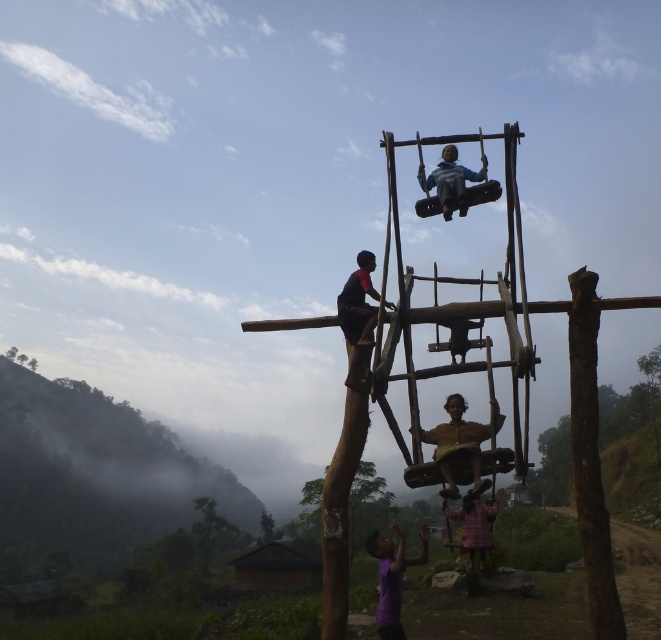
Between brown wooden swing at center and plaid fabric child at lower center, which one appears on the right side from the viewer's perspective?

Positioned to the right is plaid fabric child at lower center.

Can you confirm if brown wooden swing at center is bigger than plaid fabric child at lower center?

Incorrect, brown wooden swing at center is not larger than plaid fabric child at lower center.

You are a GUI agent. You are given a task and a screenshot of the screen. Output one action in this format:
    pyautogui.click(x=<x>, y=<y>)
    Task: Click on the brown wooden swing at center
    This screenshot has height=640, width=661.
    Given the screenshot: What is the action you would take?
    pyautogui.click(x=457, y=445)

Find the location of a particular element. This screenshot has height=640, width=661. brown wooden swing at center is located at coordinates (457, 445).

Based on the photo, can you confirm if purple matte shirt at lower center is wider than blue striped shirt at upper center?

Yes.

Is point (391, 611) less distant than point (455, 205)?

Yes, point (391, 611) is in front of point (455, 205).

The width and height of the screenshot is (661, 640). I want to click on purple matte shirt at lower center, so click(x=393, y=577).

Describe the element at coordinates (449, 180) in the screenshot. I see `blue striped shirt at upper center` at that location.

Is point (457, 196) positioned after point (490, 506)?

No, it is not.

Describe the element at coordinates (449, 180) in the screenshot. The height and width of the screenshot is (640, 661). I see `blue striped shirt at upper center` at that location.

Identify the location of blue striped shirt at upper center. The width and height of the screenshot is (661, 640). (449, 180).